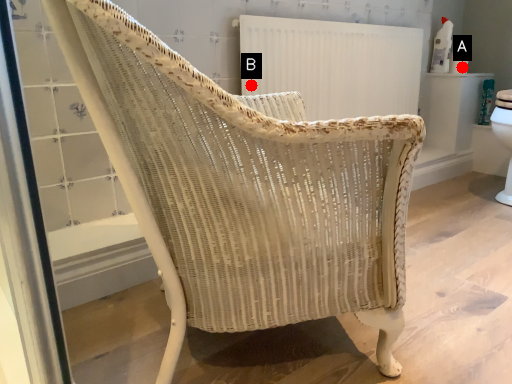
Question: Two points are circled on the image, labeled by A and B beside each circle. Which point appears farthest from the camera in this image?

Choices:
 (A) A is further
 (B) B is further

Answer: (A)